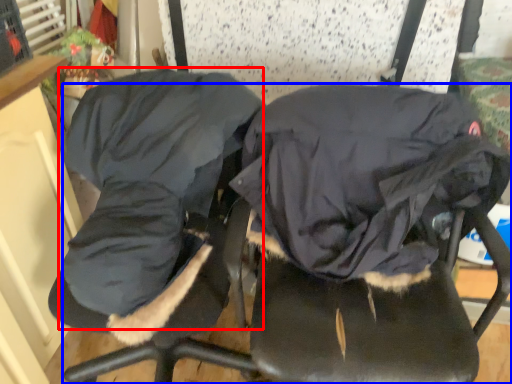
Question: Which object appears closest to the camera in this image, clothing (highlighted by a red box) or chair (highlighted by a blue box)?

Choices:
 (A) clothing
 (B) chair

Answer: (B)